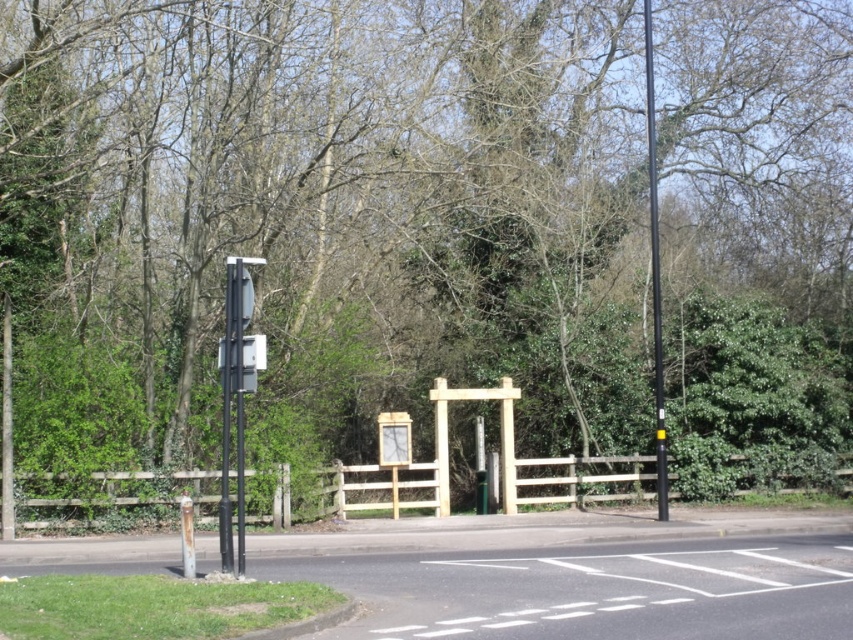
Who is more forward, (50,477) or (654,403)?

Point (50,477) is in front.

Can you confirm if wooden fence at center is positioned to the left of black smooth pole at right?

Yes, wooden fence at center is to the left of black smooth pole at right.

The image size is (853, 640). I want to click on wooden fence at center, so click(352, 492).

The width and height of the screenshot is (853, 640). I want to click on wooden fence at center, so click(x=352, y=492).

In the scene shown: Is wooden fence at center closer to camera compared to wooden frame at center?

Yes, it is in front of wooden frame at center.

Based on the photo, who is shorter, wooden fence at center or wooden frame at center?

With less height is wooden fence at center.

The height and width of the screenshot is (640, 853). In order to click on wooden fence at center in this screenshot , I will do `click(352, 492)`.

Which is in front, point (251, 346) or point (503, 468)?

Point (251, 346) is more forward.

Can you confirm if metallic street sign at left is smaller than wooden frame at center?

Yes, metallic street sign at left is smaller than wooden frame at center.

Image resolution: width=853 pixels, height=640 pixels. I want to click on metallic street sign at left, so click(x=236, y=396).